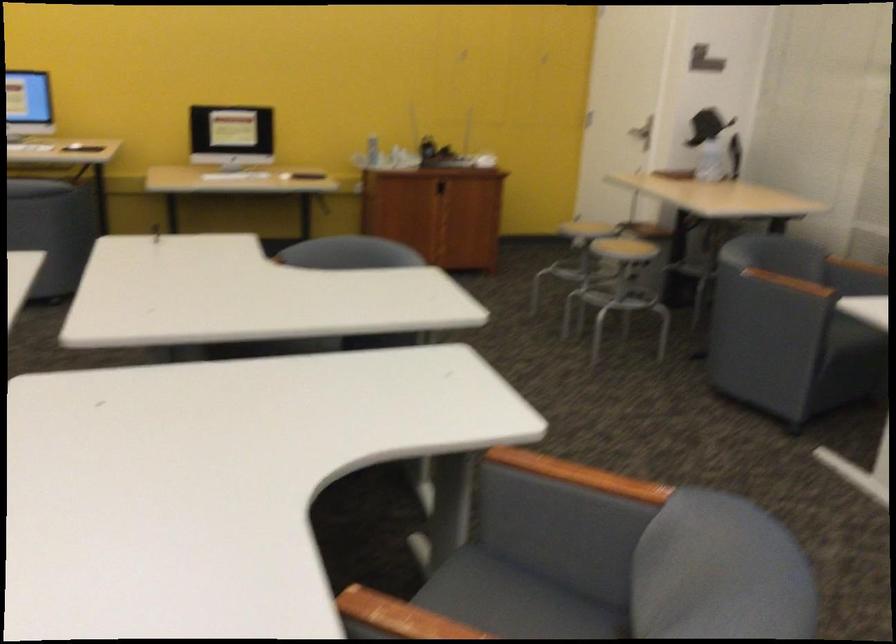
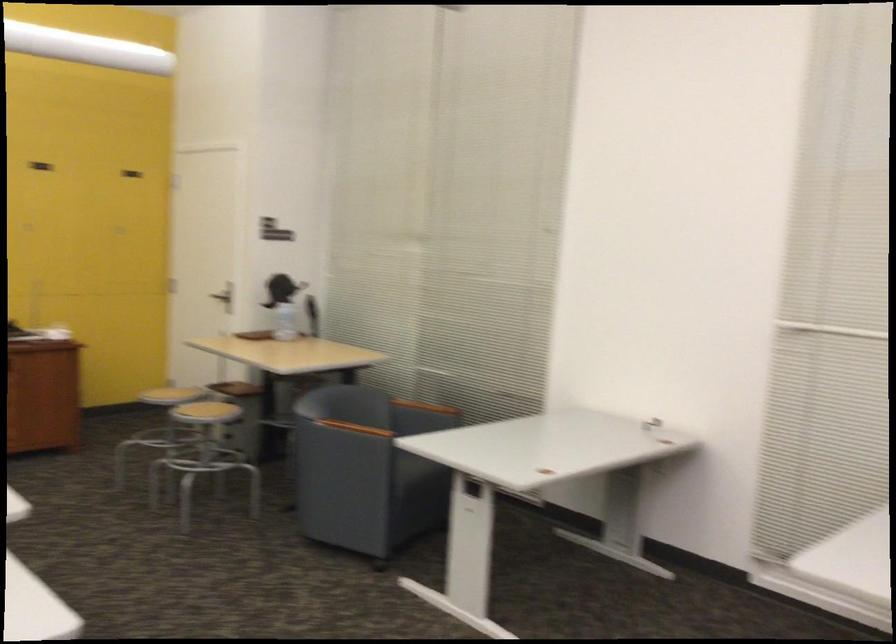
In a continuous first-person perspective shot, in which direction is the camera moving?

The cameraman walked toward right, backward.